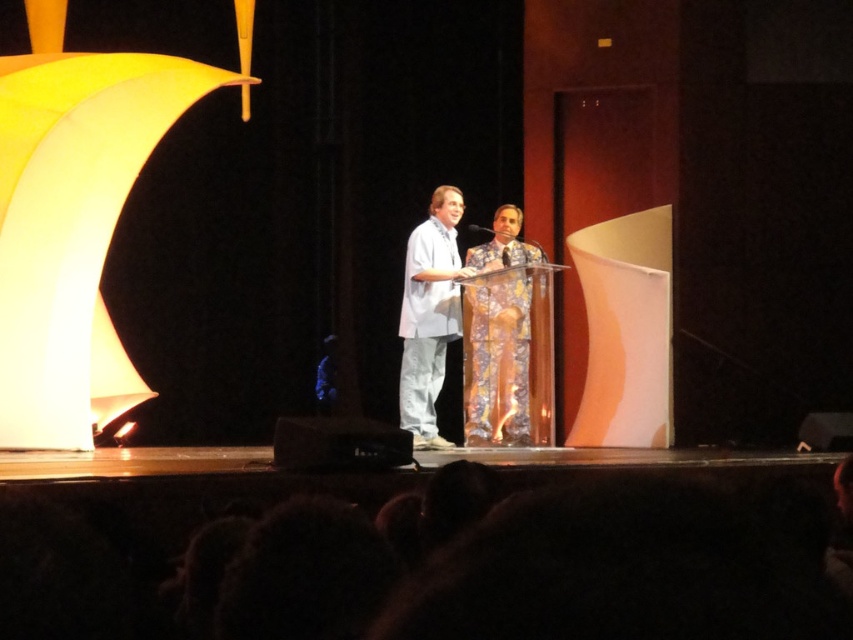
You are standing in front of the stage and want to know how far the point at coordinates point (508,230) is from you. Can you determine the distance?

The point at coordinates point (508,230) is 9.13 meters from the camera, so the distance from you to that point is approximately 9.13 meters.